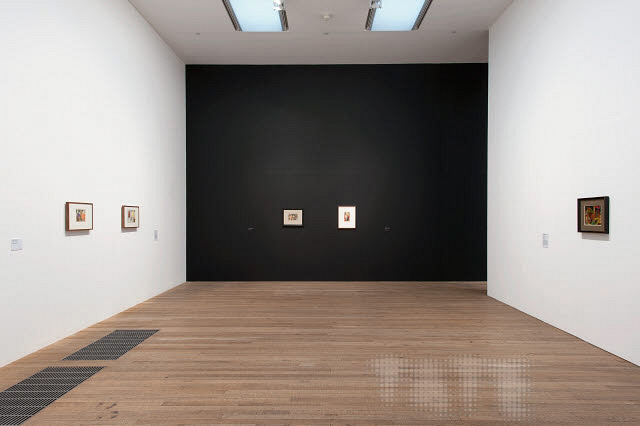
In order to click on 1 black wall in this screenshot , I will do `click(283, 146)`.